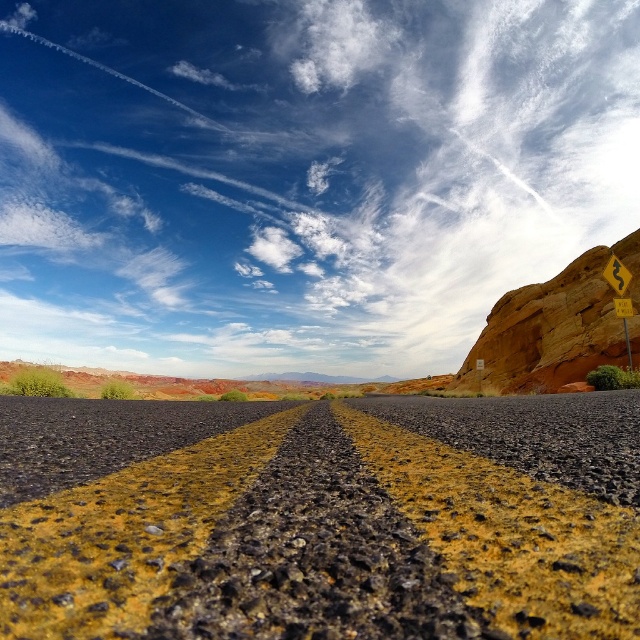
You are a photographer standing at the camera position capturing the desert road scene. You notice two points marked in the image at coordinates point (60, 476) and point (620, 275). Which point would appear larger in your photo?

Point (60, 476) appears larger in the photo because it is closer to the camera than point (620, 275).

You are standing at the point marked by the coordinates point (317, 518) in the image. What is the name of the object you are currently standing on?

The point (317, 518) indicates the black asphalt road at center, so you are standing on the black asphalt road at center.

You are a driver approaching the black asphalt road at center and the rustic stone mountain at right. Which object appears taller from your perspective?

The rustic stone mountain at right appears taller than the black asphalt road at center because the description states that the black asphalt road at center has a lesser height compared to rustic stone mountain at right.